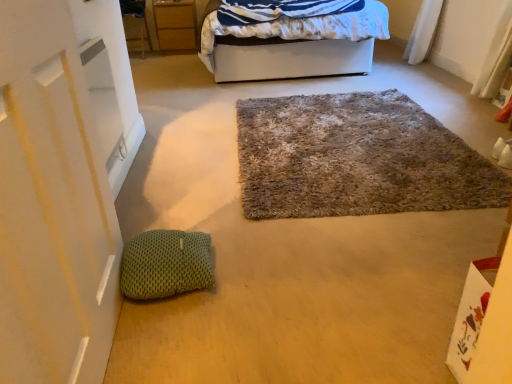
Where is `spots to the right of green knitted pillow at lower left`? The height and width of the screenshot is (384, 512). spots to the right of green knitted pillow at lower left is located at coordinates (245, 272).